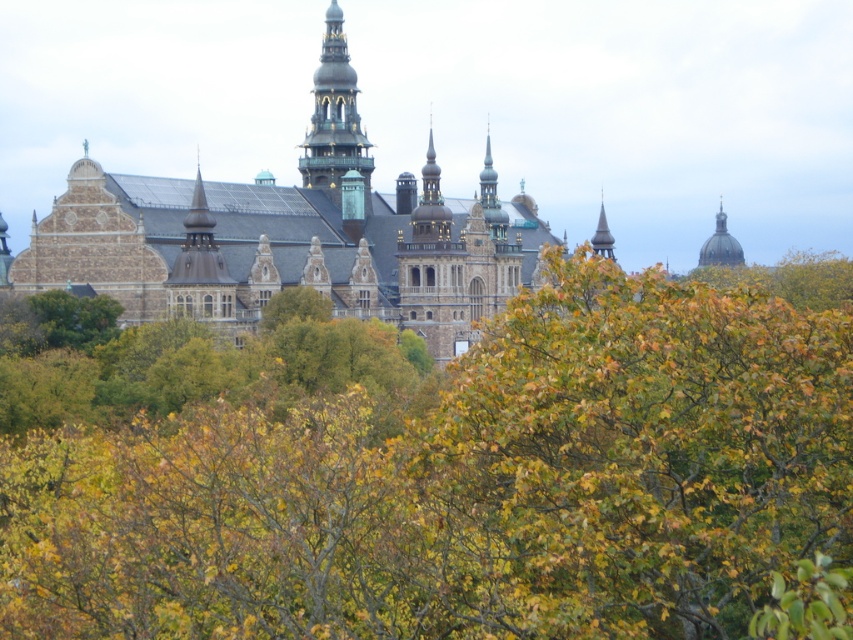
Between point (412, 323) and point (325, 176), which one is positioned behind?

The point (325, 176) is behind.

Locate an element on the screen. brown stone castle at center is located at coordinates (289, 234).

Locate an element on the screen. The width and height of the screenshot is (853, 640). brown stone castle at center is located at coordinates (289, 234).

Find the location of a particular element. Image resolution: width=853 pixels, height=640 pixels. brown stone castle at center is located at coordinates (289, 234).

Locate an element on the screen. This screenshot has height=640, width=853. green leafy tree at center is located at coordinates (434, 472).

Which is above, green leafy tree at center or smooth gold dome at upper right?

smooth gold dome at upper right is above.

The height and width of the screenshot is (640, 853). Describe the element at coordinates (434, 472) in the screenshot. I see `green leafy tree at center` at that location.

The image size is (853, 640). What are the coordinates of `green leafy tree at center` in the screenshot? It's located at (434, 472).

Does green leafy tree at center have a greater height compared to green copper tower at upper center?

Correct, green leafy tree at center is much taller as green copper tower at upper center.

Who is more distant from viewer, [119,611] or [314,170]?

Positioned behind is point [314,170].

At what (x,y) coordinates should I click in order to perform the action: click on green leafy tree at center. Please return your answer as a coordinate pair (x, y). This screenshot has height=640, width=853. Looking at the image, I should click on (434, 472).